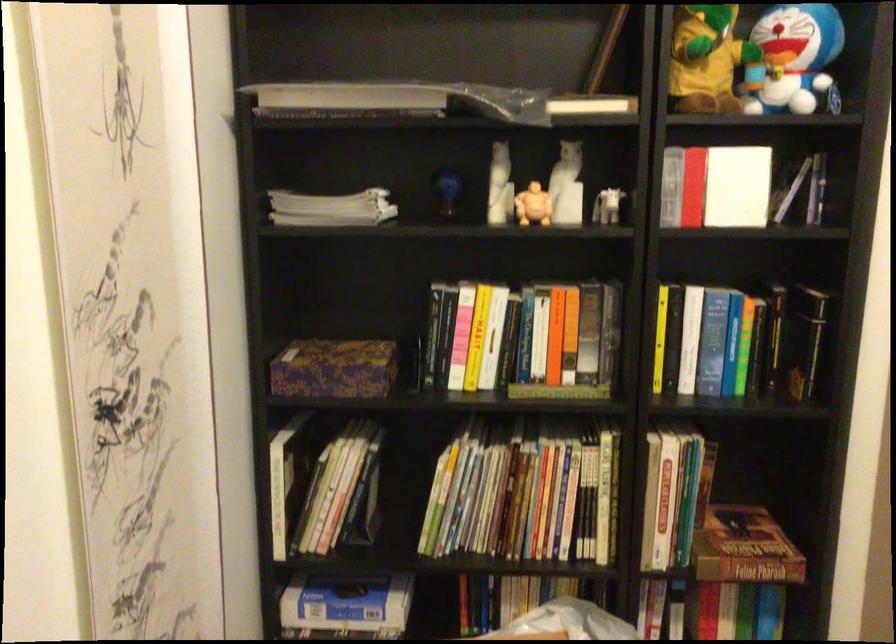
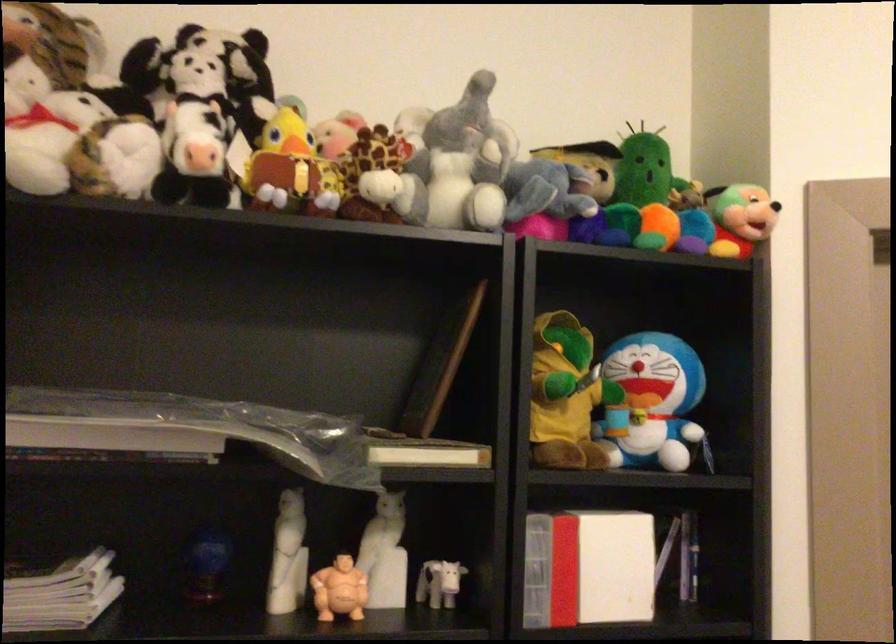
The first image is from the beginning of the video and the second image is from the end. How did the camera likely rotate when shooting the video?

The rotation direction of the camera is right-up.